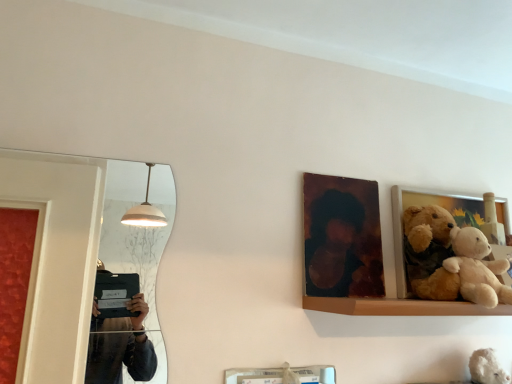
In order to click on wooden photo frame at upper center, positioned as the second picture frame in right-to-left order in this screenshot , I will do `click(342, 237)`.

This screenshot has width=512, height=384. I want to click on white plush teddy bear at lower right, so click(x=487, y=368).

Is soft plush teddy bear at right to the right of wooden picture frame at right, the 2th picture frame from the left, from the viewer's perspective?

Incorrect, soft plush teddy bear at right is not on the right side of wooden picture frame at right, the 2th picture frame from the left.

Is soft plush teddy bear at right inside or outside of wooden picture frame at right, the 2th picture frame from the left?

soft plush teddy bear at right is not enclosed by wooden picture frame at right, the 2th picture frame from the left.

From a real-world perspective, is soft plush teddy bear at right physically below wooden picture frame at right, the 2th picture frame from the left?

Yes, from a real-world perspective, soft plush teddy bear at right is under wooden picture frame at right, the 2th picture frame from the left.

Which is farther, (483, 371) or (362, 253)?

Positioned behind is point (483, 371).

Is white plush teddy bear at lower right closer to camera compared to wooden photo frame at upper center, positioned as the second picture frame in right-to-left order?

Yes, it is.

Is white plush teddy bear at lower right to the left or to the right of wooden photo frame at upper center, positioned as the second picture frame in right-to-left order, in the image?

white plush teddy bear at lower right is positioned on wooden photo frame at upper center, positioned as the second picture frame in right-to-left order,'s right side.

In terms of height, does white plush teddy bear at lower right look taller or shorter compared to wooden photo frame at upper center, the first picture frame positioned from the left?

white plush teddy bear at lower right is shorter than wooden photo frame at upper center, the first picture frame positioned from the left.

Is wooden picture frame at right, marked as the first picture frame in a right-to-left arrangement, inside the boundaries of wooden photo frame at upper center, the first picture frame positioned from the left, or outside?

wooden picture frame at right, marked as the first picture frame in a right-to-left arrangement, exists outside the volume of wooden photo frame at upper center, the first picture frame positioned from the left.

Considering the positions of objects wooden picture frame at right, marked as the first picture frame in a right-to-left arrangement, and wooden photo frame at upper center, the first picture frame positioned from the left, in the image provided, who is in front, wooden picture frame at right, marked as the first picture frame in a right-to-left arrangement, or wooden photo frame at upper center, the first picture frame positioned from the left,?

wooden photo frame at upper center, the first picture frame positioned from the left.

Is wooden picture frame at right, marked as the first picture frame in a right-to-left arrangement, turned away from wooden photo frame at upper center, the first picture frame positioned from the left?

That's not correct — wooden picture frame at right, marked as the first picture frame in a right-to-left arrangement, is not looking away from wooden photo frame at upper center, the first picture frame positioned from the left.

Can you confirm if wooden picture frame at right, the 2th picture frame from the left, is bigger than wooden photo frame at upper center, the first picture frame positioned from the left?

Yes, wooden picture frame at right, the 2th picture frame from the left, is bigger than wooden photo frame at upper center, the first picture frame positioned from the left.

Can you tell me how much wooden photo frame at upper center, positioned as the second picture frame in right-to-left order, and white plush teddy bear at lower right differ in facing direction?

The angular difference between wooden photo frame at upper center, positioned as the second picture frame in right-to-left order, and white plush teddy bear at lower right is 11.7 degrees.

Which is nearer, (355, 209) or (490, 371)?

Point (355, 209) appears to be closer to the viewer than point (490, 371).

Measure the distance from wooden photo frame at upper center, positioned as the second picture frame in right-to-left order, to white plush teddy bear at lower right.

wooden photo frame at upper center, positioned as the second picture frame in right-to-left order, and white plush teddy bear at lower right are 20.65 inches apart.

Considering the positions of objects wooden photo frame at upper center, the first picture frame positioned from the left, and white plush teddy bear at lower right in the image provided, who is in front, wooden photo frame at upper center, the first picture frame positioned from the left, or white plush teddy bear at lower right?

Positioned in front is white plush teddy bear at lower right.

Where is `picture frame located above the wooden picture frame at right, the 2th picture frame from the left (from a real-world perspective)`? The image size is (512, 384). picture frame located above the wooden picture frame at right, the 2th picture frame from the left (from a real-world perspective) is located at coordinates (x=342, y=237).

Consider the image. Would you say wooden photo frame at upper center, positioned as the second picture frame in right-to-left order, contains wooden picture frame at right, marked as the first picture frame in a right-to-left arrangement?

That's incorrect, wooden picture frame at right, marked as the first picture frame in a right-to-left arrangement, is not inside wooden photo frame at upper center, positioned as the second picture frame in right-to-left order.

Does wooden photo frame at upper center, positioned as the second picture frame in right-to-left order, come in front of wooden picture frame at right, the 2th picture frame from the left?

Yes.

Which of these two, wooden photo frame at upper center, positioned as the second picture frame in right-to-left order, or wooden picture frame at right, marked as the first picture frame in a right-to-left arrangement, is wider?

wooden picture frame at right, marked as the first picture frame in a right-to-left arrangement.

Does soft plush teddy bear at right have a greater width compared to wooden photo frame at upper center, the first picture frame positioned from the left?

Correct, the width of soft plush teddy bear at right exceeds that of wooden photo frame at upper center, the first picture frame positioned from the left.

Who is bigger, soft plush teddy bear at right or wooden photo frame at upper center, positioned as the second picture frame in right-to-left order?

soft plush teddy bear at right is bigger.

Does point (502, 262) appear closer or farther from the camera than point (314, 255)?

Point (502, 262) is closer to the camera than point (314, 255).

Considering the relative positions of soft plush teddy bear at right and white plush teddy bear at lower right in the image provided, is soft plush teddy bear at right to the left of white plush teddy bear at lower right from the viewer's perspective?

Yes, soft plush teddy bear at right is to the left of white plush teddy bear at lower right.

Based on the photo, from the image's perspective, does soft plush teddy bear at right appear lower than white plush teddy bear at lower right?

No.

Is soft plush teddy bear at right placed right next to white plush teddy bear at lower right?

No, soft plush teddy bear at right is not in contact with white plush teddy bear at lower right.

What's the angular difference between soft plush teddy bear at right and white plush teddy bear at lower right's facing directions?

The facing directions of soft plush teddy bear at right and white plush teddy bear at lower right are 10.3 degrees apart.

Where is `picture frame that is the 1st object located above the soft plush teddy bear at right (from the image's perspective)`? Image resolution: width=512 pixels, height=384 pixels. picture frame that is the 1st object located above the soft plush teddy bear at right (from the image's perspective) is located at coordinates (426, 231).

You are a GUI agent. You are given a task and a screenshot of the screen. Output one action in this format:
    pyautogui.click(x=<x>, y=<y>)
    Task: Click on the teddy below the wooden photo frame at upper center, positioned as the second picture frame in right-to-left order (from the image's perspective)
    
    Given the screenshot: What is the action you would take?
    pyautogui.click(x=487, y=368)

Estimate the real-world distances between objects in this image. Which object is further from wooden picture frame at right, the 2th picture frame from the left, soft plush teddy bear at right or white plush teddy bear at lower right?

white plush teddy bear at lower right is further to wooden picture frame at right, the 2th picture frame from the left.

Which object lies nearer to the anchor point soft plush teddy bear at right, white plush teddy bear at lower right or wooden photo frame at upper center, positioned as the second picture frame in right-to-left order?

wooden photo frame at upper center, positioned as the second picture frame in right-to-left order, lies closer to soft plush teddy bear at right than the other object.

Which object lies further to the anchor point white plush teddy bear at lower right, soft plush teddy bear at right or wooden picture frame at right, the 2th picture frame from the left?

wooden picture frame at right, the 2th picture frame from the left, is further to white plush teddy bear at lower right.

Considering their positions, is white plush teddy bear at lower right positioned further to soft plush teddy bear at right than wooden picture frame at right, marked as the first picture frame in a right-to-left arrangement?

white plush teddy bear at lower right is positioned further to the anchor soft plush teddy bear at right.

Looking at the image, which one is located further to soft plush teddy bear at right, wooden picture frame at right, the 2th picture frame from the left, or wooden photo frame at upper center, positioned as the second picture frame in right-to-left order?

wooden photo frame at upper center, positioned as the second picture frame in right-to-left order, lies further to soft plush teddy bear at right than the other object.

Based on the photo, estimate the real-world distances between objects in this image. Which object is closer to soft plush teddy bear at right, wooden picture frame at right, the 2th picture frame from the left, or white plush teddy bear at lower right?

wooden picture frame at right, the 2th picture frame from the left, is closer to soft plush teddy bear at right.

Estimate the real-world distances between objects in this image. Which object is closer to wooden photo frame at upper center, positioned as the second picture frame in right-to-left order, soft plush teddy bear at right or white plush teddy bear at lower right?

The object closer to wooden photo frame at upper center, positioned as the second picture frame in right-to-left order, is soft plush teddy bear at right.

Considering their positions, is soft plush teddy bear at right positioned closer to wooden photo frame at upper center, positioned as the second picture frame in right-to-left order, than wooden picture frame at right, the 2th picture frame from the left?

wooden picture frame at right, the 2th picture frame from the left.

This screenshot has height=384, width=512. Find the location of `teddy bear that lies between wooden picture frame at right, the 2th picture frame from the left, and white plush teddy bear at lower right from top to bottom`. teddy bear that lies between wooden picture frame at right, the 2th picture frame from the left, and white plush teddy bear at lower right from top to bottom is located at coordinates (477, 268).

This screenshot has height=384, width=512. I want to click on teddy bear between wooden photo frame at upper center, positioned as the second picture frame in right-to-left order, and white plush teddy bear at lower right, in the vertical direction, so click(x=477, y=268).

You are a GUI agent. You are given a task and a screenshot of the screen. Output one action in this format:
    pyautogui.click(x=<x>, y=<y>)
    Task: Click on the teddy bear located between wooden photo frame at upper center, the first picture frame positioned from the left, and wooden picture frame at right, the 2th picture frame from the left, in the left-right direction
    The height and width of the screenshot is (384, 512).
    Given the screenshot: What is the action you would take?
    pyautogui.click(x=477, y=268)

Where is `picture frame between wooden photo frame at upper center, positioned as the second picture frame in right-to-left order, and white plush teddy bear at lower right from top to bottom`? picture frame between wooden photo frame at upper center, positioned as the second picture frame in right-to-left order, and white plush teddy bear at lower right from top to bottom is located at coordinates (426, 231).